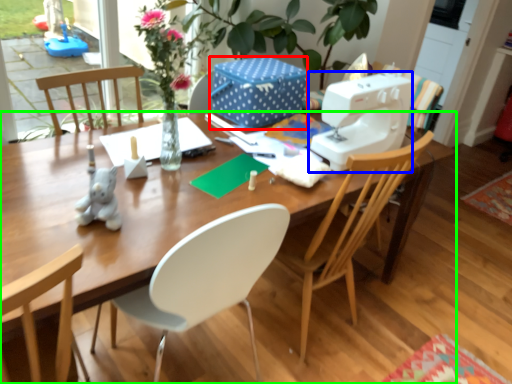
Question: Which object is positioned farthest from box (highlighted by a red box)? Select from sewing machine (highlighted by a blue box) and desk (highlighted by a green box).

Choices:
 (A) sewing machine
 (B) desk

Answer: (B)